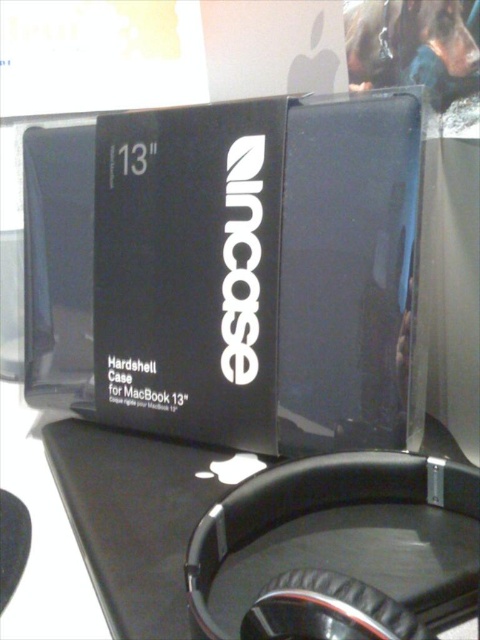
You are a customer in a store looking at the Incase Hardshell Case for a 13 inch MacBook. The store has a rule that items must be placed exactly at the center of the display area. Is the black hardshell case at center positioned correctly according to the store policy?

The black hardshell case at center is positioned at point (250, 276), which is the center of the display area, so it is correctly placed according to the store policy.

You are organizing a store display and need to place a new item between the black hardshell case at center and the black matte table at center. Where should you place it to ensure it is between them?

The black hardshell case at center is to the right of the black matte table at center, so placing the new item between them would require positioning it to the right of the black matte table at center and to the left of the black hardshell case at center.